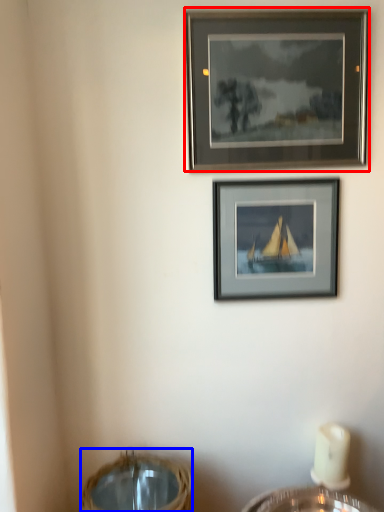
Question: Among these objects, which one is farthest to the camera, picture frame (highlighted by a red box) or basket (highlighted by a blue box)?

Choices:
 (A) picture frame
 (B) basket

Answer: (A)